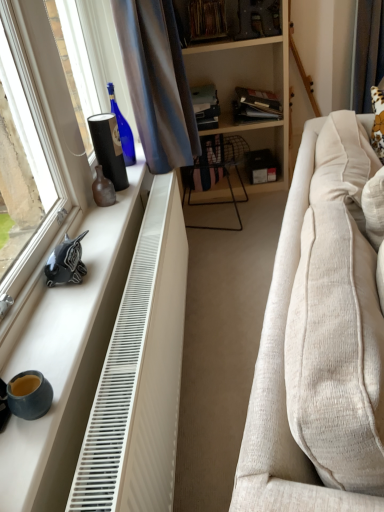
Locate an element on the screen. The height and width of the screenshot is (512, 384). vacant area that lies between black glossy unicorn at left and matte blue coffee cup at lower left is located at coordinates (56, 330).